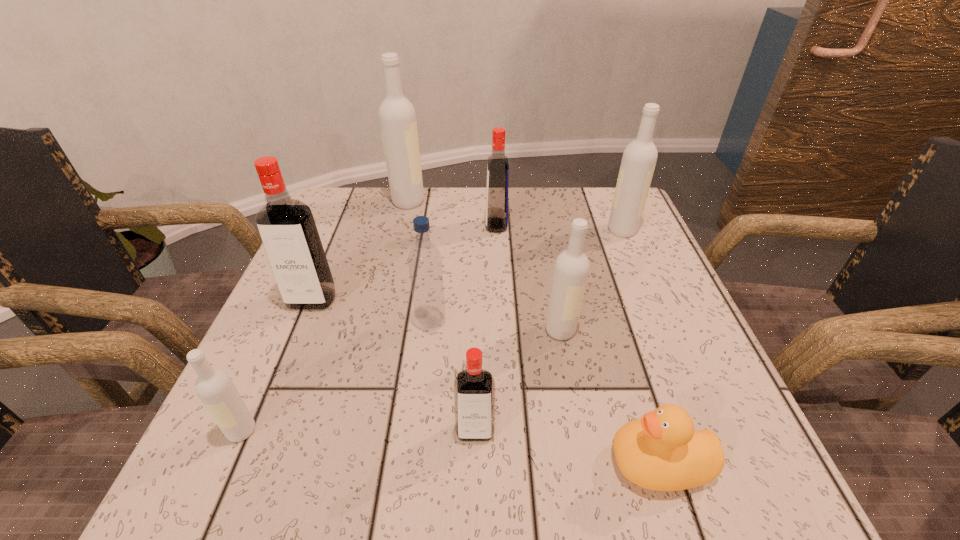
The height and width of the screenshot is (540, 960). I want to click on the fifth closest object relative to the water bottle, so click(214, 387).

Locate which vodka is the fourth closest to the sixth object from right to left. Please provide its 2D coordinates. Your answer should be formatted as a tuple, i.e. [(x, y)], where the tuple contains the x and y coordinates of a point satisfying the conditions above.

[(497, 167)]

Where is `the sixth closest vodka relative to the blue water bottle`? the sixth closest vodka relative to the blue water bottle is located at coordinates (397, 117).

This screenshot has height=540, width=960. I want to click on white vodka identified as the second closest to the second farthest white vodka, so click(397, 117).

You are a GUI agent. You are given a task and a screenshot of the screen. Output one action in this format:
    pyautogui.click(x=<x>, y=<y>)
    Task: Click on the white vodka that is the third closest one to the seventh object from right to left
    
    Given the screenshot: What is the action you would take?
    pyautogui.click(x=214, y=387)

This screenshot has width=960, height=540. Identify the location of the second closest red vodka to the leftmost white vodka. (474, 388).

The height and width of the screenshot is (540, 960). Find the location of `red vodka that is the closest to the farthest red vodka`. red vodka that is the closest to the farthest red vodka is located at coordinates (286, 226).

I want to click on free space that satisfies the following two spatial constraints: 1. on the front side of the rightmost vodka; 2. on the face of the yellow duck, so click(720, 463).

You are a GUI agent. You are given a task and a screenshot of the screen. Output one action in this format:
    pyautogui.click(x=<x>, y=<y>)
    Task: Click on the vacant space that satisfies the following two spatial constraints: 1. on the front and back of the second biggest red vodka; 2. on the front and back of the biggest red vodka
    
    Given the screenshot: What is the action you would take?
    pyautogui.click(x=500, y=300)

The image size is (960, 540). I want to click on free location that satisfies the following two spatial constraints: 1. on the front and back of the rightmost white vodka; 2. on the left side of the second biggest red vodka, so click(496, 231).